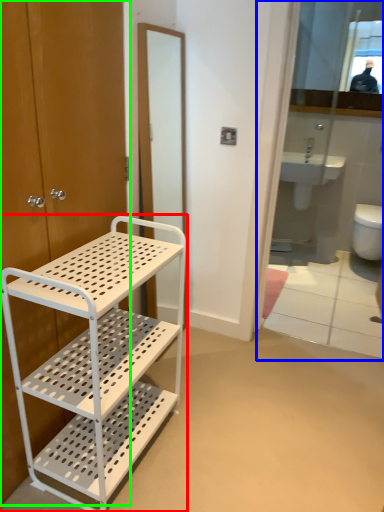
Question: Which object is the farthest from bathroom cabinet (highlighted by a red box)? Choose among these: mirror (highlighted by a blue box) or door (highlighted by a green box).

Choices:
 (A) mirror
 (B) door

Answer: (A)